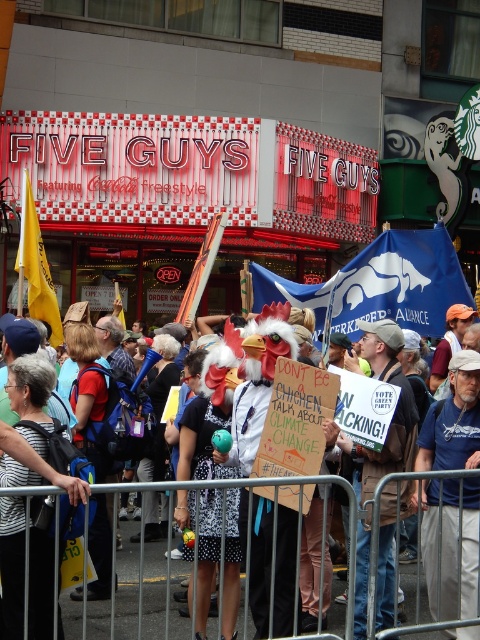
Question: Can you confirm if white polka dot dress at center is bigger than blue cotton t-shirt at center?

Choices:
 (A) yes
 (B) no

Answer: (A)

Question: Is white polka dot dress at center below blue cotton t-shirt at center?

Choices:
 (A) yes
 (B) no

Answer: (B)

Question: Does white polka dot dress at center appear over blue cotton t-shirt at center?

Choices:
 (A) yes
 (B) no

Answer: (A)

Question: Which point is farther to the camera?

Choices:
 (A) (447, 512)
 (B) (380, 544)

Answer: (B)